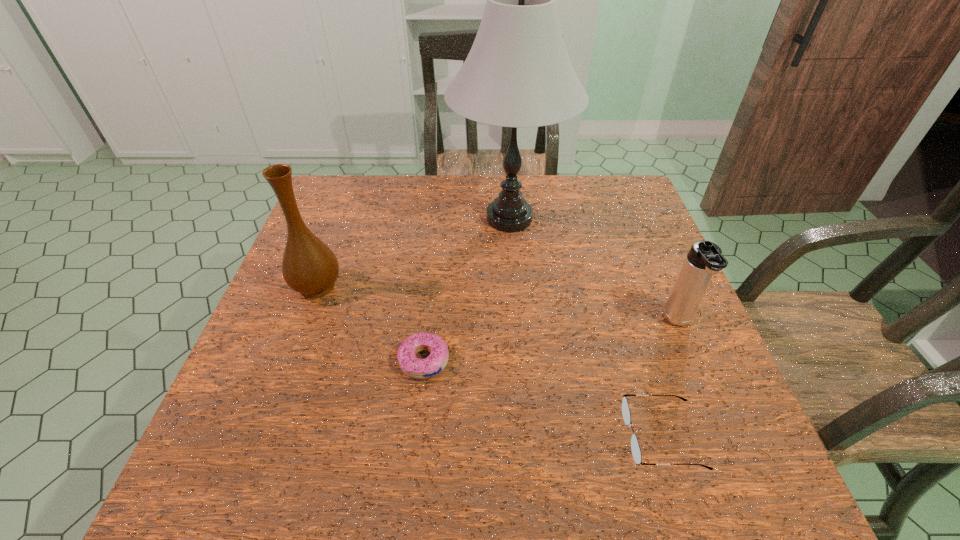
In order to click on spectacles at the right edge in this screenshot , I will do `click(635, 448)`.

Find the location of a particular element. object present at the near right corner is located at coordinates (635, 448).

Identify the location of free space at the far edge of the desktop. (466, 208).

The image size is (960, 540). In the image, there is a desktop. What are the coordinates of `blank space at the near edge` in the screenshot? It's located at (354, 460).

The height and width of the screenshot is (540, 960). Identify the location of vacant region at the left edge of the desktop. (263, 426).

In the image, there is a desktop. Find the location of `vacant space at the right edge`. vacant space at the right edge is located at coordinates (710, 362).

I want to click on free spot at the far left corner of the desktop, so click(x=328, y=183).

In the image, there is a desktop. At what (x,y) coordinates should I click in order to perform the action: click on vacant area at the far right corner. Please return your answer as a coordinate pair (x, y). This screenshot has width=960, height=540. Looking at the image, I should click on (597, 204).

Find the location of a particular element. vacant region at the near right corner of the desktop is located at coordinates (736, 491).

The width and height of the screenshot is (960, 540). I want to click on vacant point located between the third shortest object and the tallest object, so click(594, 271).